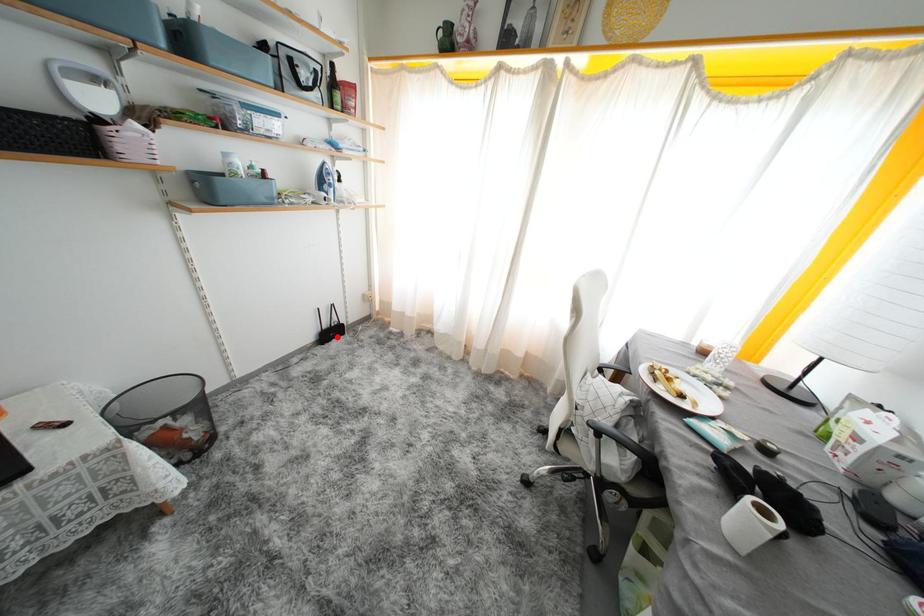
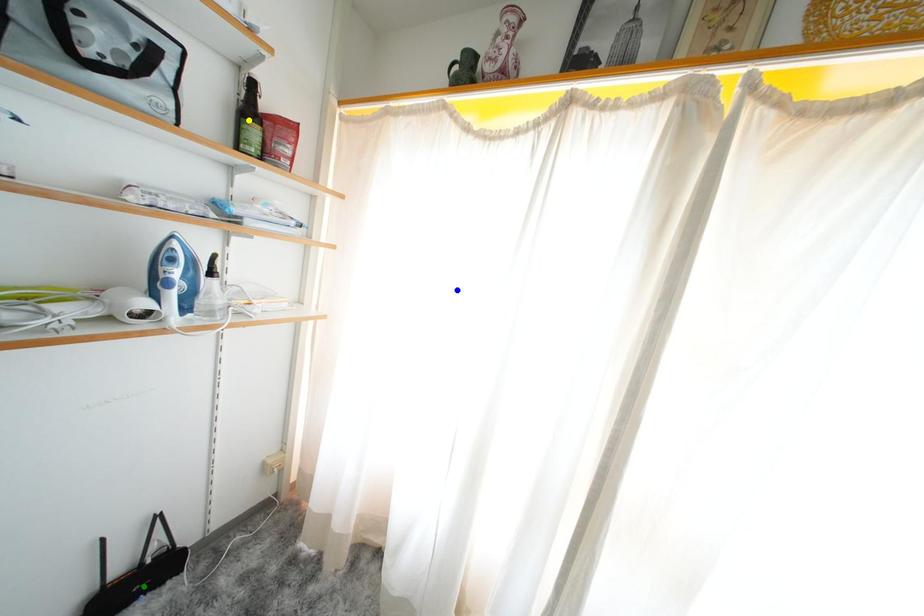
Question: I am providing you with two images of the same scene from different viewpoints. A red point is marked on the first image. You are given multiple points on the second image. Can you choose the point in image 2 that corresponds to the point in image 1?

Choices:
 (A) green point
 (B) blue point
 (C) yellow point

Answer: (A)